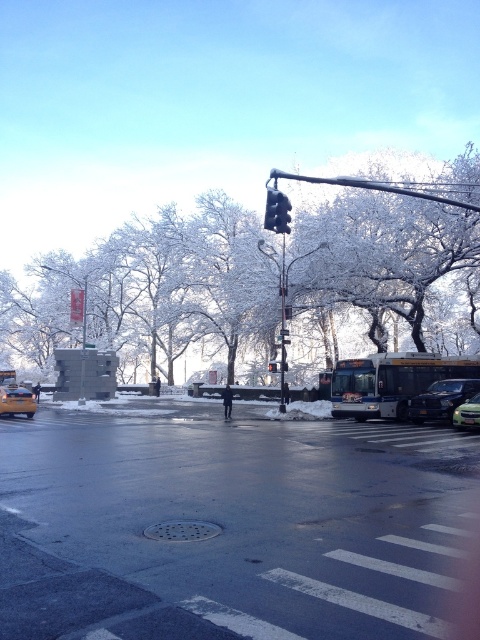
Question: Can you confirm if shiny black car at center is positioned to the right of yellow matte taxi at lower left?

Choices:
 (A) no
 (B) yes

Answer: (B)

Question: Which point appears farthest from the camera in this image?

Choices:
 (A) (412, 228)
 (B) (272, 371)
 (C) (431, 417)

Answer: (A)

Question: Is white frosty tree at upper center closer to the viewer compared to black plastic traffic light at center?

Choices:
 (A) no
 (B) yes

Answer: (B)

Question: Is metallic silver sedan at center-right positioned in front of black plastic traffic light at center?

Choices:
 (A) no
 (B) yes

Answer: (B)

Question: Which object is farther from the camera taking this photo?

Choices:
 (A) white frosty tree at upper center
 (B) metallic silver sedan at center
 (C) metallic silver sedan at center-right

Answer: (C)

Question: Which point is closer to the camera?

Choices:
 (A) (268, 332)
 (B) (465, 400)

Answer: (B)